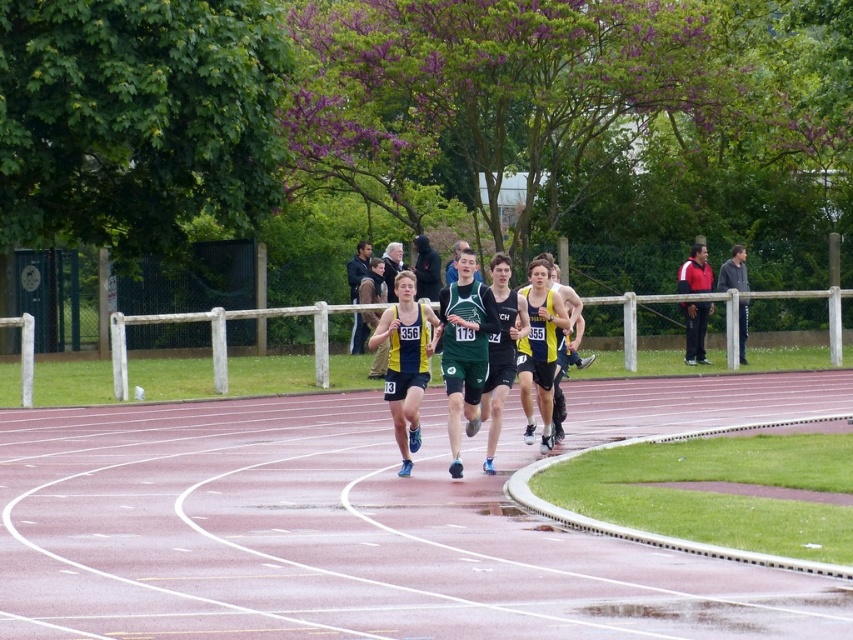
You are a photographer standing at the starting line of the track. You want to take a photo that includes both the green athletic uniform at center and the red and white jacket at upper right. Given that your camera has a maximum focus range of 40 feet, will you be able to capture both subjects in focus?

The green athletic uniform at center and the red and white jacket at upper right are 40.10 feet apart. Since the distance between them exceeds the camera maximum focus range of 40 feet, you won

You are a photographer at the track event and want to capture both the green athletic uniform at center and the red and white jacket at upper right in the same frame. Which object should you focus on first to ensure both are in focus?

The green athletic uniform at center is taller than the red and white jacket at upper right, so you should focus on the green athletic uniform at center first to ensure both are in focus.

You are a photographer at the track event and want to capture both the green matte jersey at center and the red and white jacket at upper right in a single photo. Given that your camera has a fixed focal length, which object should you position closer to the camera to ensure both are in focus?

The green matte jersey at center is smaller than the red and white jacket at upper right. To ensure both are in focus, you should position the camera closer to the green matte jersey at center since smaller objects require less depth of field to capture clearly when compared to larger objects at the same distance.